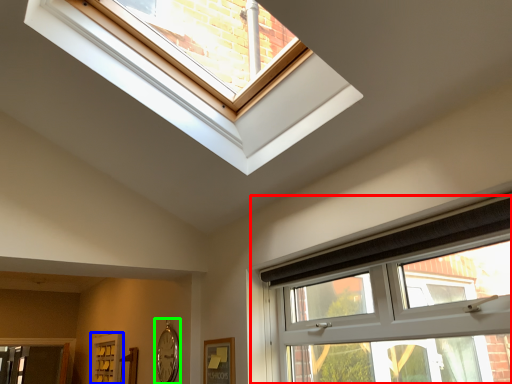
Question: Which is farther away from window (highlighted by a red box)? screen door (highlighted by a blue box) or clock (highlighted by a green box)?

Choices:
 (A) screen door
 (B) clock

Answer: (A)